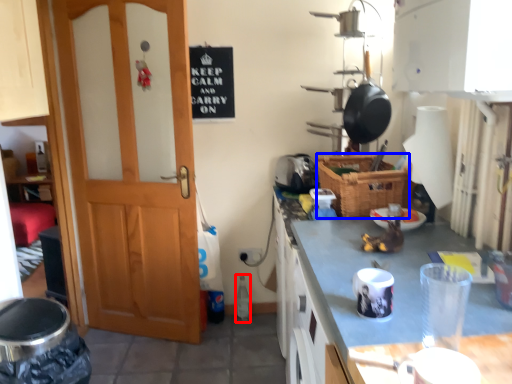
Question: Which point is closer to the camera, bottle (highlighted by a red box) or basket (highlighted by a blue box)?

Choices:
 (A) bottle
 (B) basket

Answer: (B)